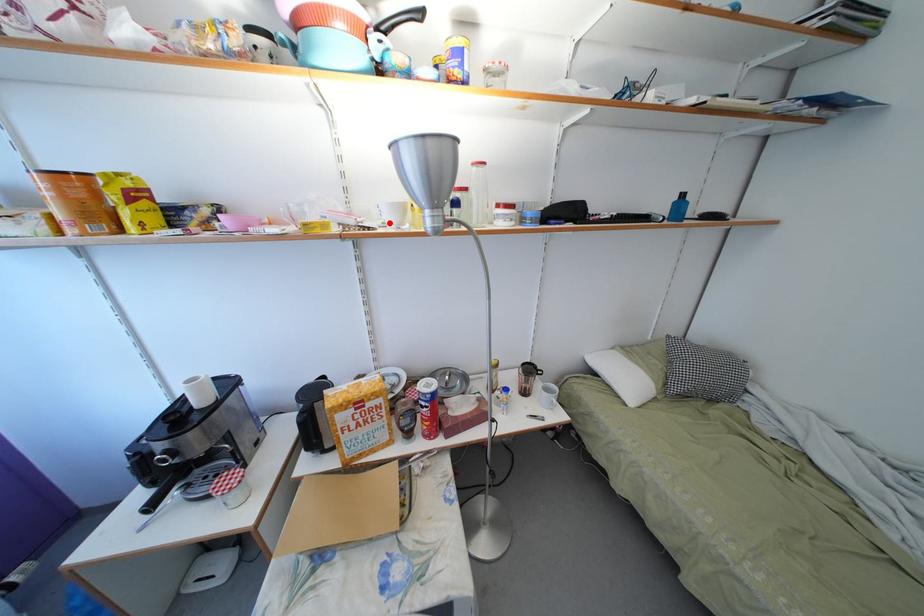
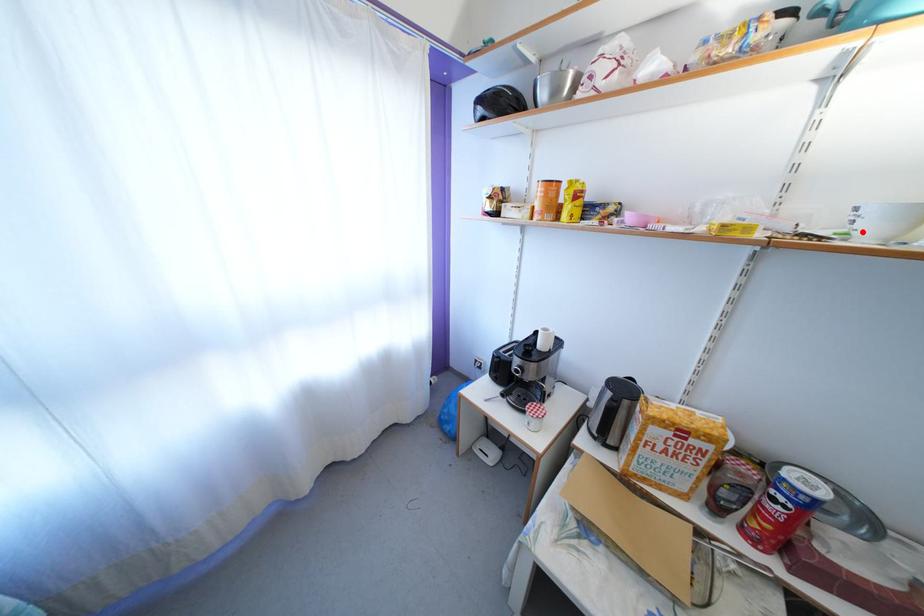
I am providing you with two images of the same scene from different viewpoints. A red point is marked on the first image and another point is marked on the second image. Do the highlighted points in image1 and image2 indicate the same real-world spot?

Yes